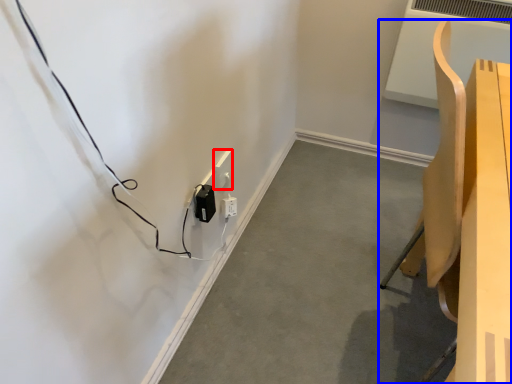
Question: Which object appears farthest to the camera in this image, electric outlet (highlighted by a red box) or furniture (highlighted by a blue box)?

Choices:
 (A) electric outlet
 (B) furniture

Answer: (A)